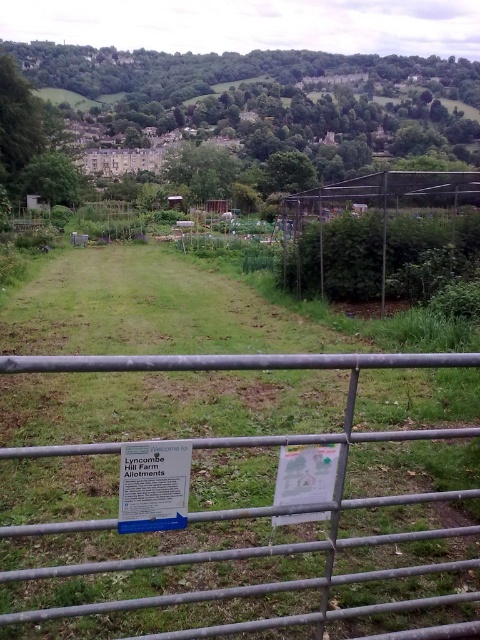
Question: Is metal gate at center below wire mesh fence at center?

Choices:
 (A) yes
 (B) no

Answer: (A)

Question: Is white plastic sign at center smaller than wire mesh fence at center?

Choices:
 (A) yes
 (B) no

Answer: (A)

Question: Which point is closer to the camera taking this photo?

Choices:
 (A) (149, 465)
 (B) (15, 529)

Answer: (B)

Question: Does metal gate at center have a lesser width compared to white plastic sign at center?

Choices:
 (A) yes
 (B) no

Answer: (B)

Question: Considering the real-world distances, which object is closest to the wire mesh fence at center?

Choices:
 (A) metal gate at center
 (B) white plastic sign at center

Answer: (A)

Question: Based on their relative distances, which object is farther from the white plastic sign at center?

Choices:
 (A) metal gate at center
 (B) wire mesh fence at center

Answer: (B)